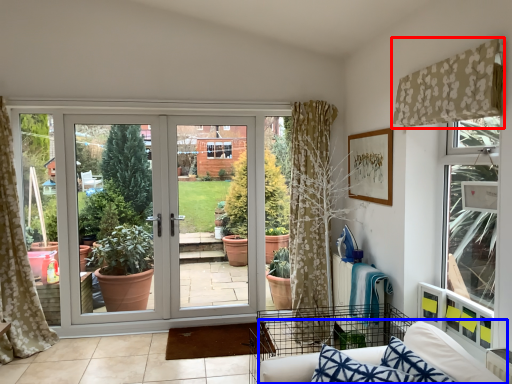
Question: Which object appears farthest to the camera in this image, curtain (highlighted by a red box) or couch (highlighted by a blue box)?

Choices:
 (A) curtain
 (B) couch

Answer: (A)